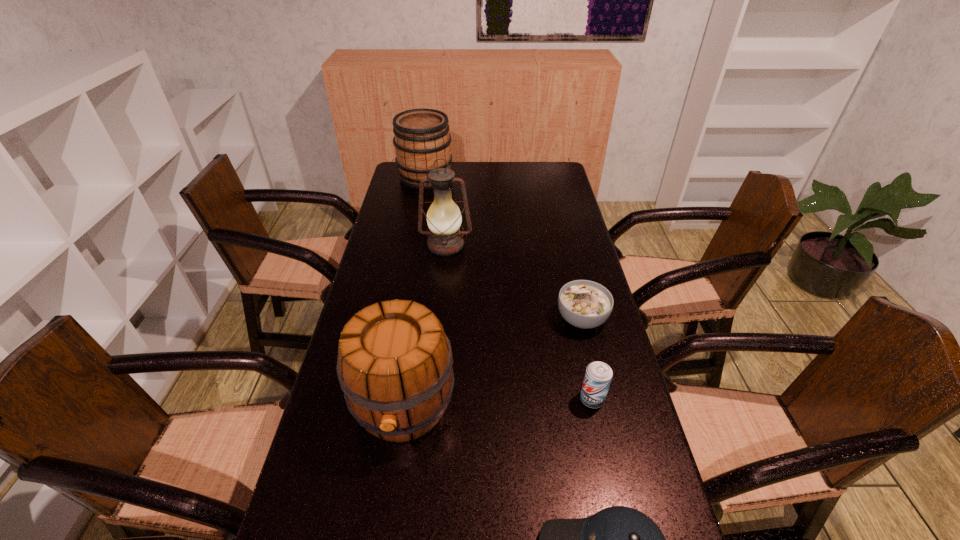
This screenshot has height=540, width=960. Identify the location of vacant area between the soup bowl and the farthest object. [x=504, y=248].

Where is `vacant area that lies between the second farthest object and the third shortest object`? The width and height of the screenshot is (960, 540). vacant area that lies between the second farthest object and the third shortest object is located at coordinates (519, 322).

Identify the location of free space between the farther cider and the nearer cider. This screenshot has height=540, width=960. pos(415,291).

Locate an element on the screen. free area in between the farther cider and the fourth nearest object is located at coordinates pos(504,248).

This screenshot has height=540, width=960. Identify the location of the second closest object to the nearer cider. (585, 304).

Locate an element on the screen. object that is the closest to the oil lamp is located at coordinates (422, 136).

The image size is (960, 540). Identify the location of free region that satisfies the following two spatial constraints: 1. on the front side of the soup bowl; 2. on the left side of the farther cider. (398, 319).